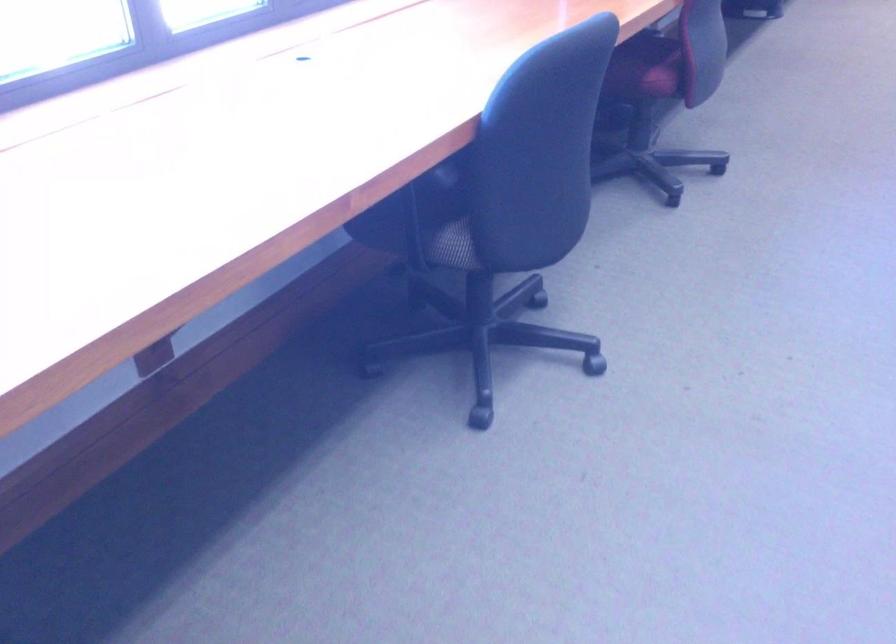
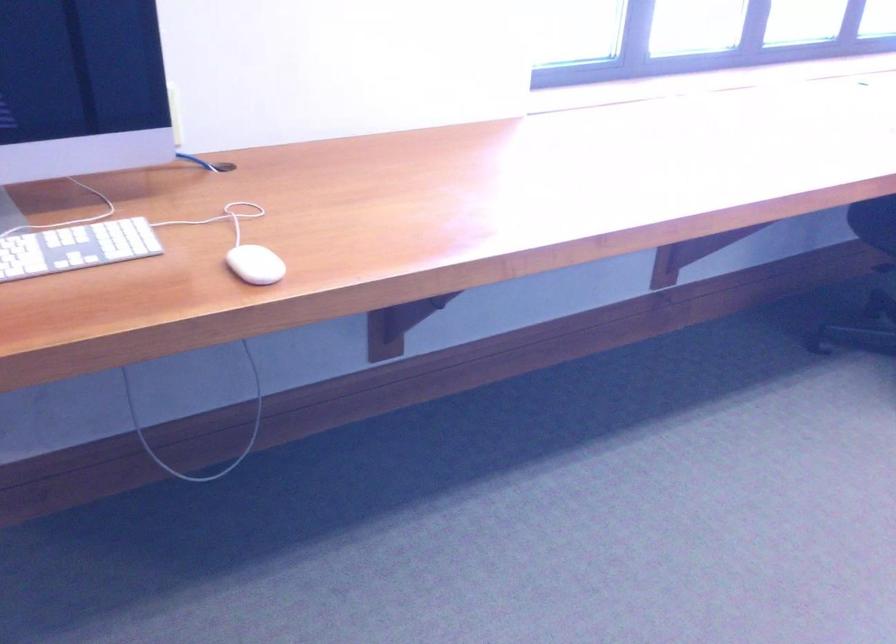
Question: The camera is either moving clockwise (left) or counter-clockwise (right) around the object. The first image is from the beginning of the video and the second image is from the end. Is the camera moving left or right when shooting the video?

Choices:
 (A) Left
 (B) Right

Answer: (B)